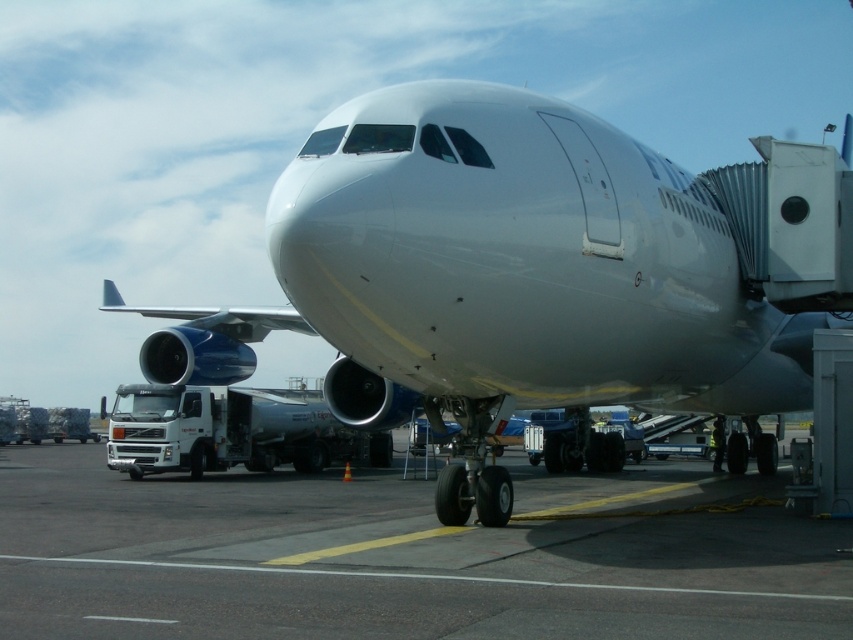
Question: Which point is farther to the camera?

Choices:
 (A) white glossy airplane at center
 (B) smooth asphalt tarmac at center

Answer: (A)

Question: Can you confirm if white glossy airplane at center is positioned below smooth asphalt tarmac at center?

Choices:
 (A) yes
 (B) no

Answer: (B)

Question: Is white glossy airplane at center bigger than smooth asphalt tarmac at center?

Choices:
 (A) yes
 (B) no

Answer: (A)

Question: Does white glossy airplane at center appear on the right side of smooth asphalt tarmac at center?

Choices:
 (A) yes
 (B) no

Answer: (A)

Question: Which of the following is the closest to the observer?

Choices:
 (A) (508, 241)
 (B) (680, 592)

Answer: (B)